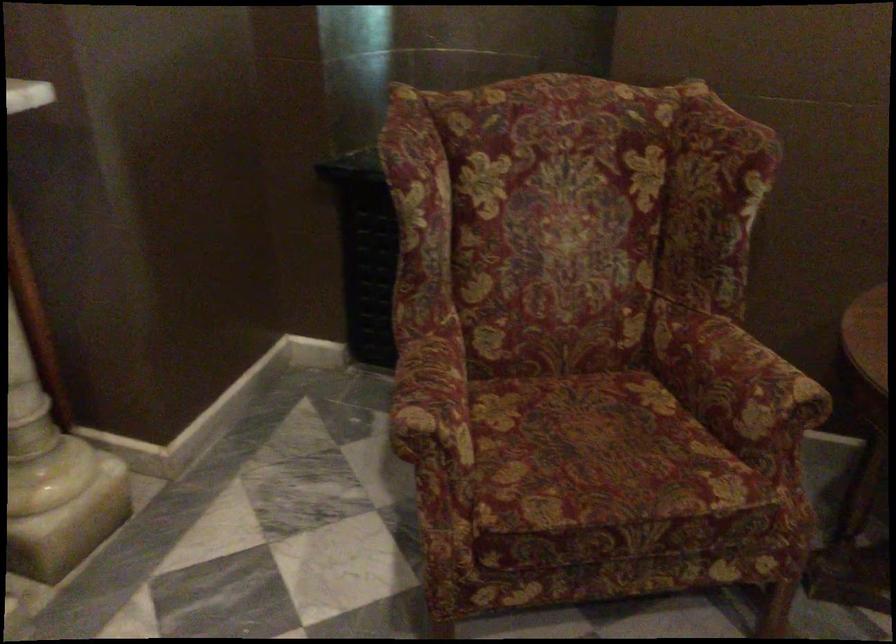
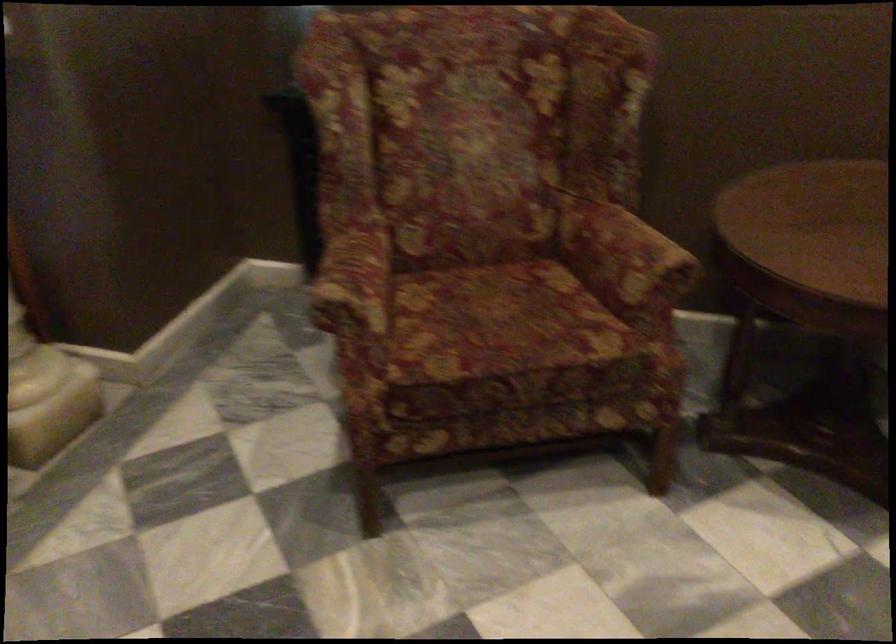
The point at [440,413] is marked in the first image. Where is the corresponding point in the second image?

(355, 286)